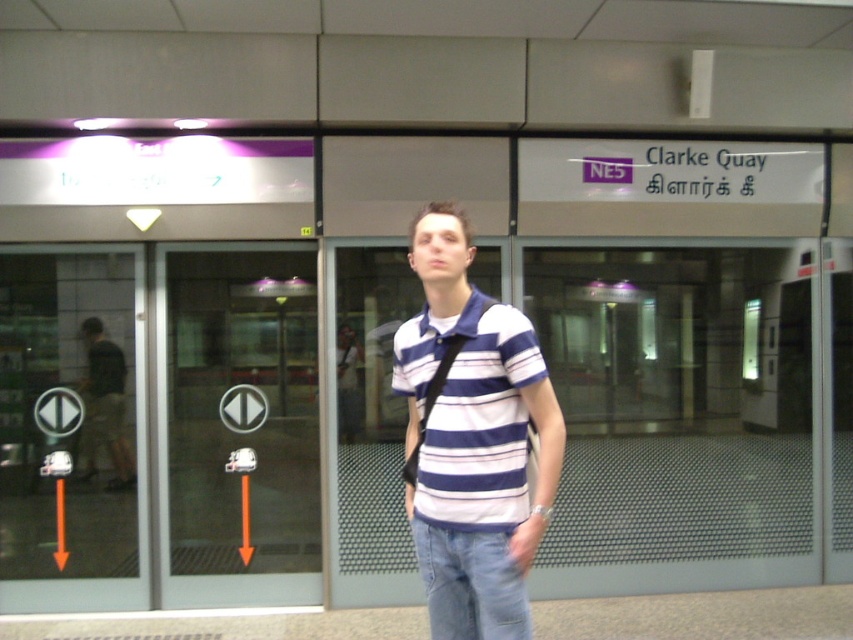
Is point (178, 563) less distant than point (112, 342)?

No, it is behind (112, 342).

Is transparent glass door at left below dark gray shirt at left?

Yes.

Which is behind, point (280, 454) or point (100, 365)?

Positioned behind is point (280, 454).

Identify the location of transparent glass door at left. The height and width of the screenshot is (640, 853). (238, 429).

Looking at this image, who is shorter, transparent glass door at left or striped cotton shirt at center?

striped cotton shirt at center

Is transparent glass door at left above striped cotton shirt at center?

Incorrect, transparent glass door at left is not positioned above striped cotton shirt at center.

Describe the element at coordinates (238, 429) in the screenshot. I see `transparent glass door at left` at that location.

You are a GUI agent. You are given a task and a screenshot of the screen. Output one action in this format:
    pyautogui.click(x=<x>, y=<y>)
    Task: Click on the transparent glass door at left
    
    Given the screenshot: What is the action you would take?
    pyautogui.click(x=238, y=429)

Can you confirm if striped cotton shirt at center is bigger than dark gray shirt at left?

Yes, striped cotton shirt at center is bigger than dark gray shirt at left.

Which is more to the right, striped cotton shirt at center or dark gray shirt at left?

striped cotton shirt at center is more to the right.

Does point (453, 401) come in front of point (111, 449)?

Yes, it is in front of point (111, 449).

Find the location of a particular element. Image resolution: width=853 pixels, height=640 pixels. striped cotton shirt at center is located at coordinates (473, 440).